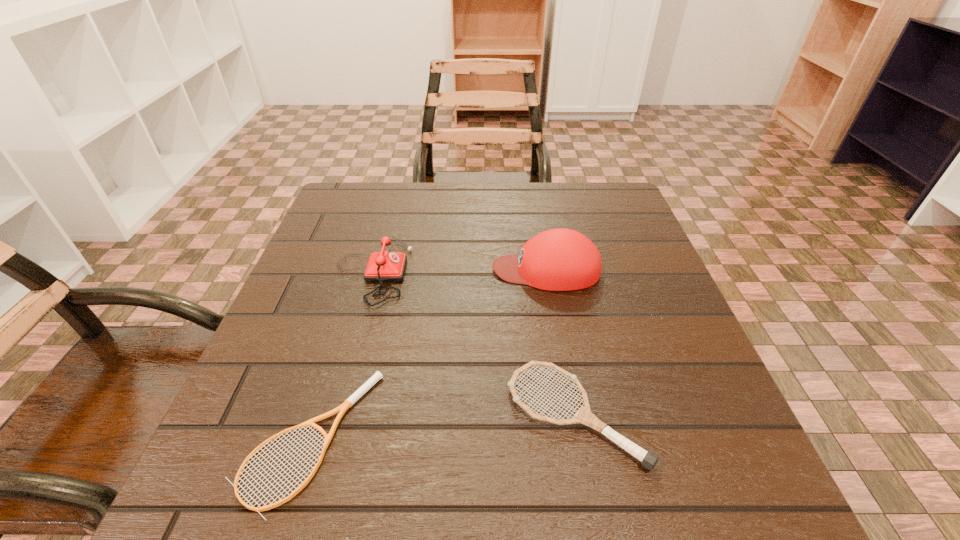
Identify the location of the tallest object. (560, 259).

Where is `telephone`? telephone is located at coordinates (384, 266).

Identify the location of the second shortest object. This screenshot has height=540, width=960. (584, 416).

This screenshot has width=960, height=540. Identify the location of the taller tennis racket. (584, 416).

Where is `the shorter tennis racket`? This screenshot has width=960, height=540. the shorter tennis racket is located at coordinates (348, 403).

Locate an element on the screen. the shortest object is located at coordinates (348, 403).

You are a GUI agent. You are given a task and a screenshot of the screen. Output one action in this format:
    pyautogui.click(x=<x>, y=<y>)
    Task: Click on the vacant space located 0.310m on the front-facing side of the tallest object
    
    Given the screenshot: What is the action you would take?
    pyautogui.click(x=348, y=269)

What are the coordinates of `free space located 0.120m on the front-facing side of the tallest object` in the screenshot? It's located at (437, 269).

Where is `free location located 0.160m on the front-facing side of the tallest object`? The image size is (960, 540). free location located 0.160m on the front-facing side of the tallest object is located at coordinates (419, 269).

You are a GUI agent. You are given a task and a screenshot of the screen. Output one action in this format:
    pyautogui.click(x=<x>, y=<y>)
    Task: Click on the vacant space located on the dial of the telephone
    
    Given the screenshot: What is the action you would take?
    pyautogui.click(x=484, y=271)